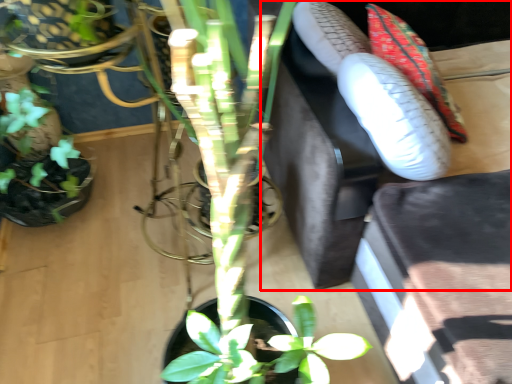
Question: From the image's perspective, what is the correct spatial positioning of couch (annotated by the red box) in reference to flower?

Choices:
 (A) below
 (B) above

Answer: (A)